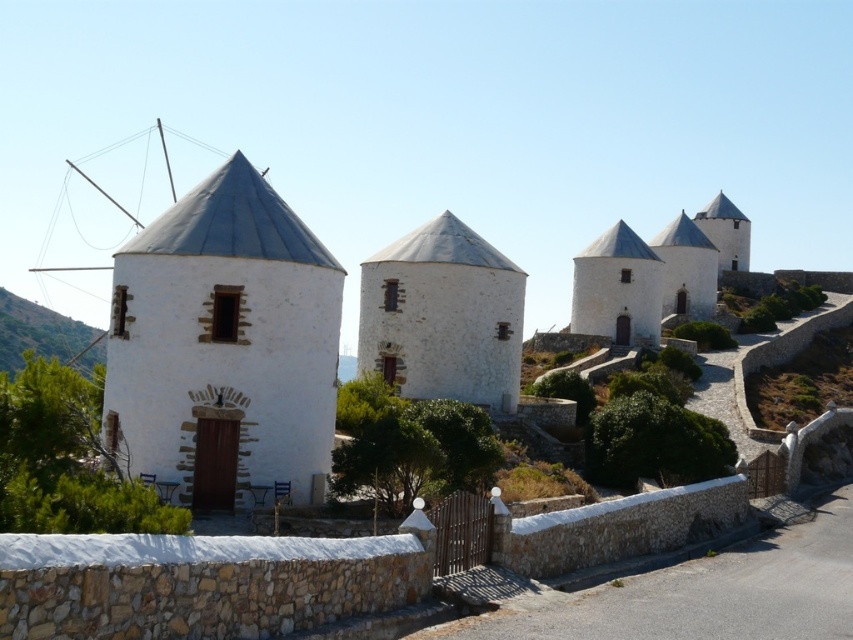
You are standing in the field and see the white stone windmill at center and the green grass at left. Which object is closer to you?

The white stone windmill at center is closer to you because it is in front of the green grass at left.

You are a tourist standing in front of the white stone windmill at left and the white stone chapel at upper right. Which one is positioned higher up in the image?

The white stone chapel at upper right is positioned higher up in the image than the white stone windmill at left.